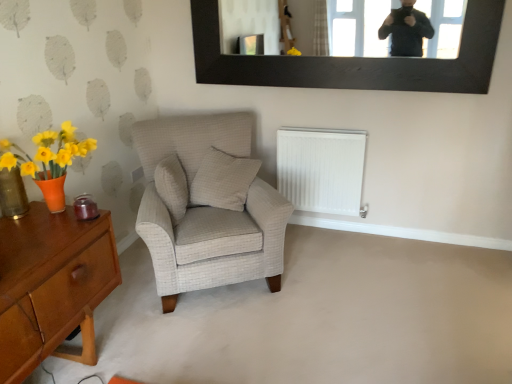
Question: Would you say beige textured pillow at center, which is the 2th pillow in right-to-left order, is part of white checkered pillow at center, the 2th pillow viewed from the left,'s contents?

Choices:
 (A) yes
 (B) no

Answer: (B)

Question: Does white checkered pillow at center, which is the 1th pillow from right to left, have a greater width compared to beige textured pillow at center, positioned as the 1th pillow in left-to-right order?

Choices:
 (A) yes
 (B) no

Answer: (A)

Question: Is white checkered pillow at center, the 2th pillow viewed from the left, in front of beige textured pillow at center, positioned as the 1th pillow in left-to-right order?

Choices:
 (A) yes
 (B) no

Answer: (B)

Question: Does white checkered pillow at center, the 2th pillow viewed from the left, have a larger size compared to beige textured pillow at center, positioned as the 1th pillow in left-to-right order?

Choices:
 (A) no
 (B) yes

Answer: (B)

Question: Is white checkered pillow at center, which is the 1th pillow from right to left, not near beige textured pillow at center, positioned as the 1th pillow in left-to-right order?

Choices:
 (A) no
 (B) yes

Answer: (A)

Question: Visually, is white plastic radiator at lower center positioned to the left or to the right of white checkered pillow at center, which is the 1th pillow from right to left?

Choices:
 (A) right
 (B) left

Answer: (A)

Question: Considering the positions of white plastic radiator at lower center and white checkered pillow at center, the 2th pillow viewed from the left, in the image, is white plastic radiator at lower center bigger or smaller than white checkered pillow at center, the 2th pillow viewed from the left,?

Choices:
 (A) big
 (B) small

Answer: (A)

Question: Is white plastic radiator at lower center taller or shorter than white checkered pillow at center, which is the 1th pillow from right to left?

Choices:
 (A) tall
 (B) short

Answer: (A)

Question: Looking at their shapes, would you say white plastic radiator at lower center is wider or thinner than white checkered pillow at center, the 2th pillow viewed from the left?

Choices:
 (A) thin
 (B) wide

Answer: (A)

Question: Does point pos(2,170) appear closer or farther from the camera than point pos(290,195)?

Choices:
 (A) closer
 (B) farther

Answer: (A)

Question: Based on their positions, is translucent amber glass vase at left located to the left or right of white plastic radiator at lower center?

Choices:
 (A) right
 (B) left

Answer: (B)

Question: Is translucent amber glass vase at left taller or shorter than white plastic radiator at lower center?

Choices:
 (A) tall
 (B) short

Answer: (B)

Question: Is translucent amber glass vase at left situated inside white plastic radiator at lower center or outside?

Choices:
 (A) outside
 (B) inside

Answer: (A)

Question: Is point [9, 264] positioned closer to the camera than point [355, 213]?

Choices:
 (A) closer
 (B) farther

Answer: (A)

Question: Considering the positions of wooden desk at lower left and white plastic radiator at lower center in the image, is wooden desk at lower left taller or shorter than white plastic radiator at lower center?

Choices:
 (A) short
 (B) tall

Answer: (B)